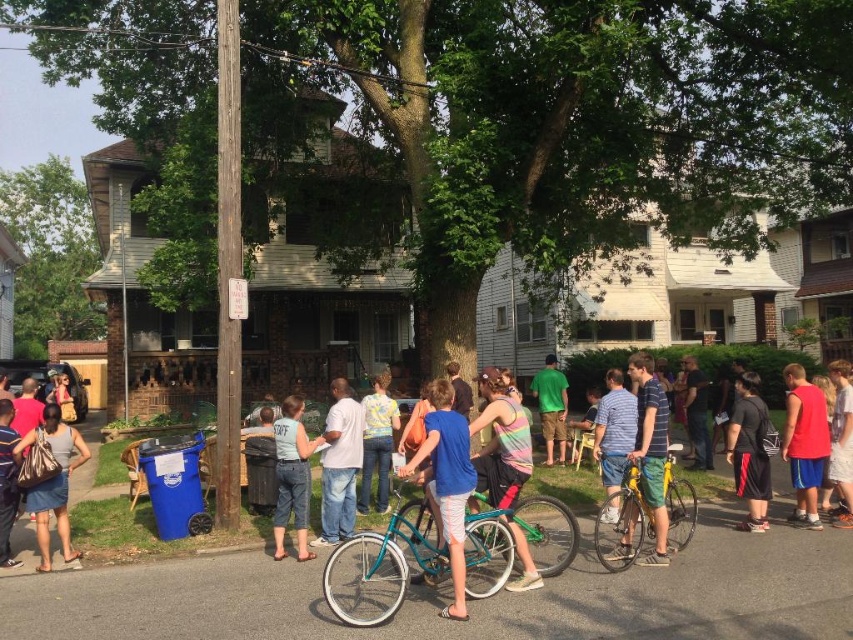
You are standing in the residential neighborhood scene and want to find the teal matte bicycle at center. Which direction should you look relative to the matte gray tank top at lower left?

The teal matte bicycle at center is to the right of the matte gray tank top at lower left, so you should look to the right of the matte gray tank top at lower left to find it.